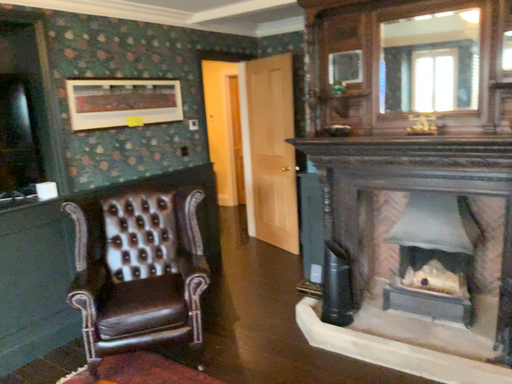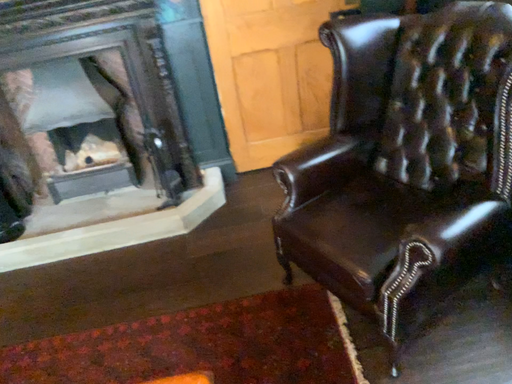
Question: Which way did the camera rotate in the video?

Choices:
 (A) rotated left
 (B) rotated right

Answer: (B)